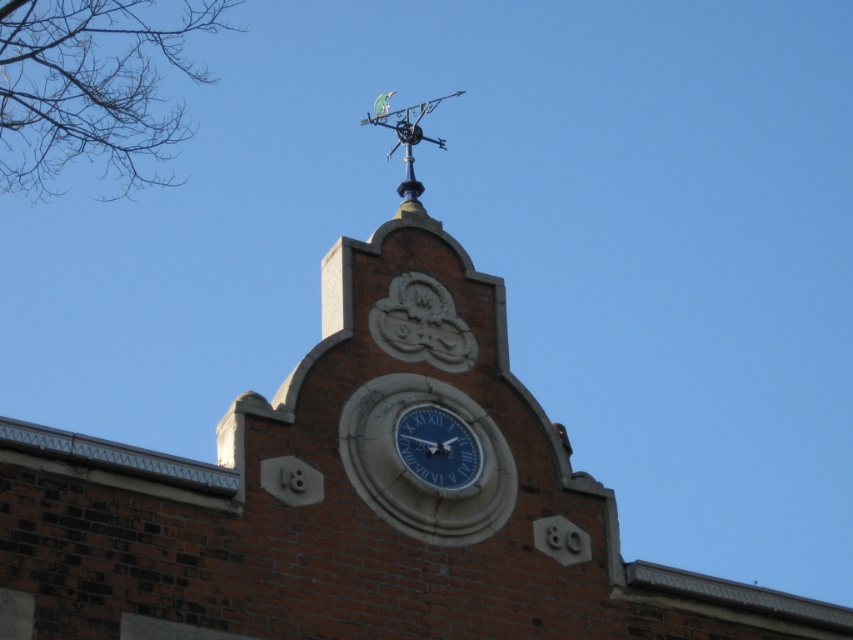
Question: Which point is farther from the camera taking this photo?

Choices:
 (A) pyautogui.click(x=450, y=477)
 (B) pyautogui.click(x=416, y=116)

Answer: (B)

Question: Does blue glossy clock at center lie in front of metallic green vane at upper center?

Choices:
 (A) yes
 (B) no

Answer: (A)

Question: Is blue glossy clock at center positioned at the back of metallic green vane at upper center?

Choices:
 (A) yes
 (B) no

Answer: (B)

Question: Observing the image, what is the correct spatial positioning of blue glossy clock at center in reference to metallic green vane at upper center?

Choices:
 (A) below
 (B) above

Answer: (A)